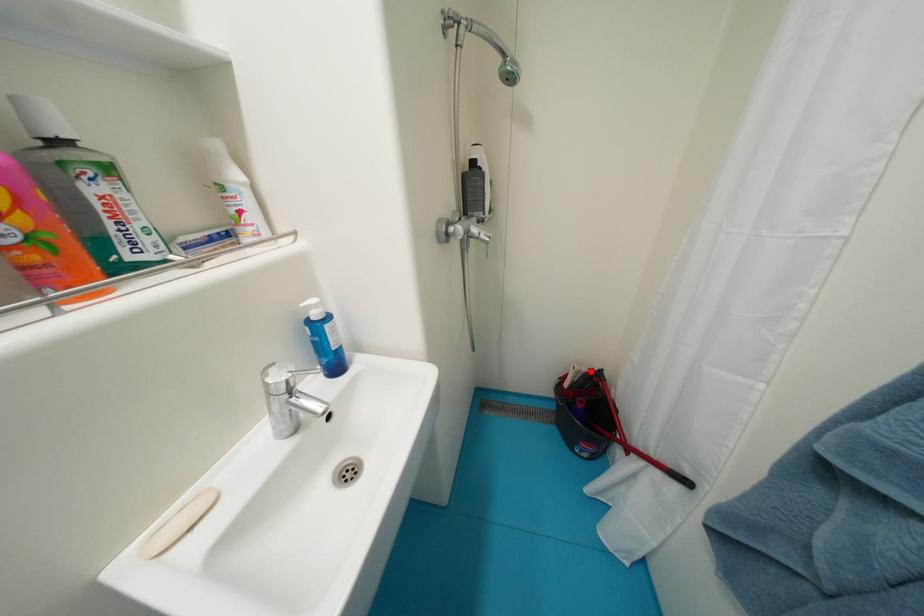
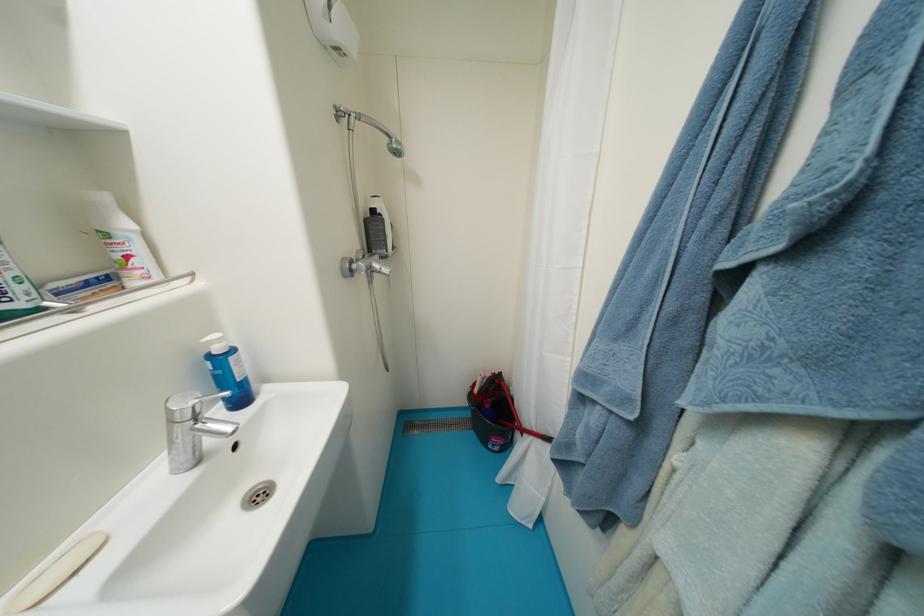
Question: I am providing you with two images of the same scene from different viewpoints. Given a red point in image1, look at the same physical point in image2. Is it:

Choices:
 (A) Closer to the viewpoint
 (B) Farther from the viewpoint

Answer: (B)